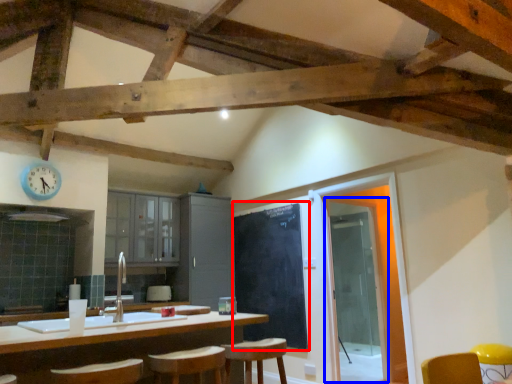
Question: Among these objects, which one is farthest to the camera, bulletin board (highlighted by a red box) or glass door (highlighted by a blue box)?

Choices:
 (A) bulletin board
 (B) glass door

Answer: (A)